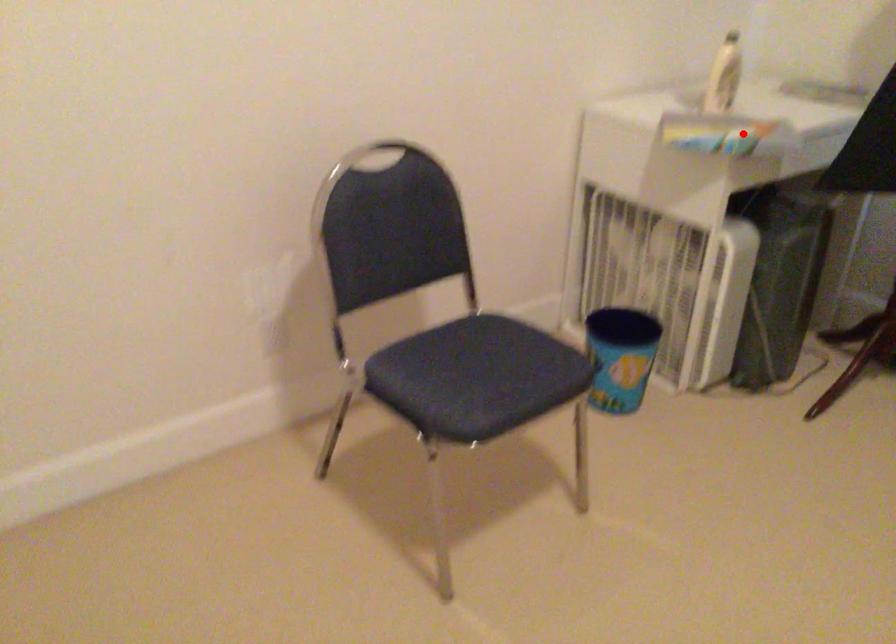
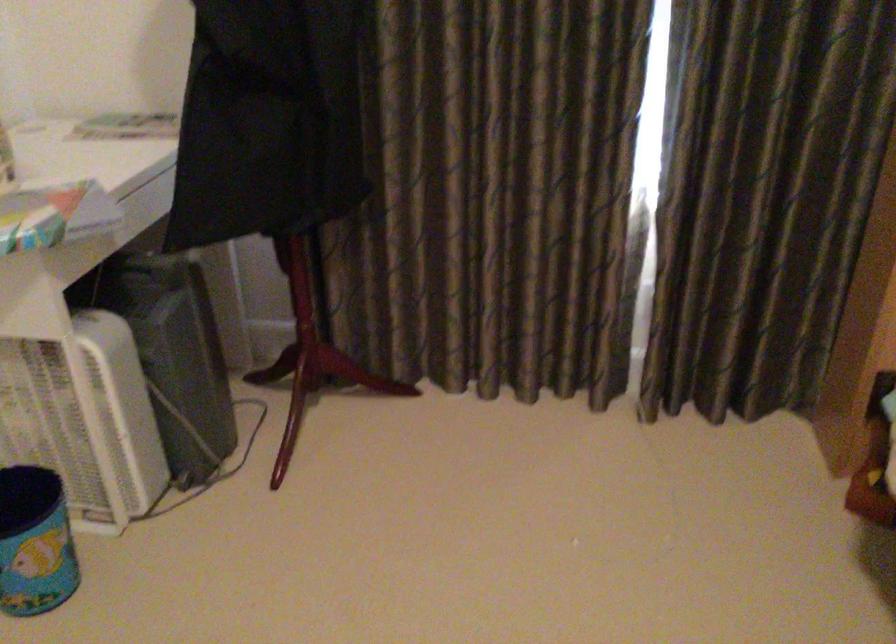
Question: I am providing you with two images of the same scene from different viewpoints. Given a red point in image1, look at the same physical point in image2. Is it:

Choices:
 (A) Closer to the viewpoint
 (B) Farther from the viewpoint

Answer: (A)